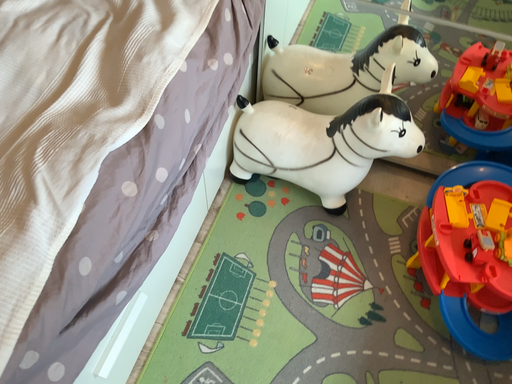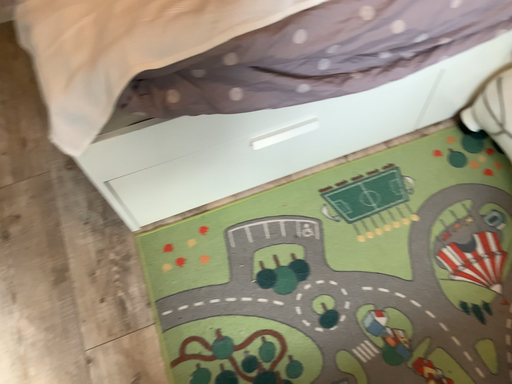
Question: Which way did the camera rotate in the video?

Choices:
 (A) rotated right
 (B) rotated left

Answer: (B)